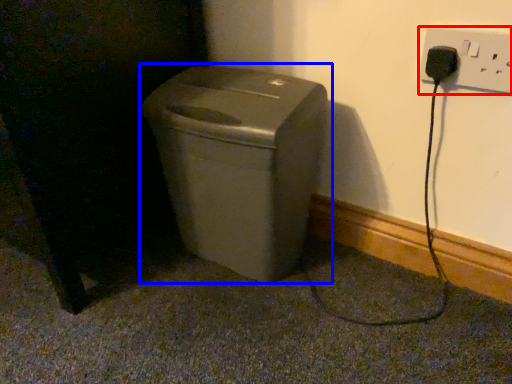
Question: Which of the following is the farthest to the observer, electric outlet (highlighted by a red box) or waste container (highlighted by a blue box)?

Choices:
 (A) electric outlet
 (B) waste container

Answer: (B)